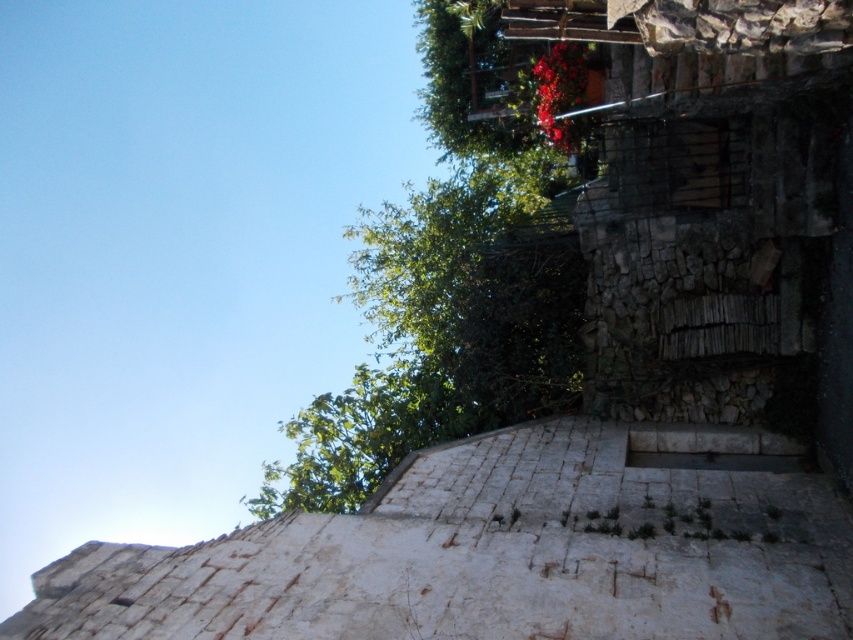
Question: Which point is closer to the camera taking this photo?

Choices:
 (A) (579, 132)
 (B) (490, 292)

Answer: (A)

Question: Can you confirm if green leafy tree at upper center is positioned to the right of bright red petals at upper center?

Choices:
 (A) yes
 (B) no

Answer: (B)

Question: Observing the image, what is the correct spatial positioning of green leafy tree at upper center in reference to bright red petals at upper center?

Choices:
 (A) right
 (B) left

Answer: (B)

Question: Which point is farther from the camera taking this photo?

Choices:
 (A) (358, 269)
 (B) (550, 58)

Answer: (A)

Question: Is green leafy tree at upper center smaller than bright red petals at upper center?

Choices:
 (A) no
 (B) yes

Answer: (A)